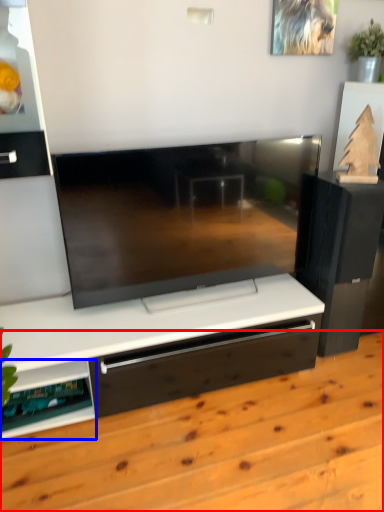
Question: Among these objects, which one is farthest to the camera, hardwood (highlighted by a red box) or shelf (highlighted by a blue box)?

Choices:
 (A) hardwood
 (B) shelf

Answer: (B)